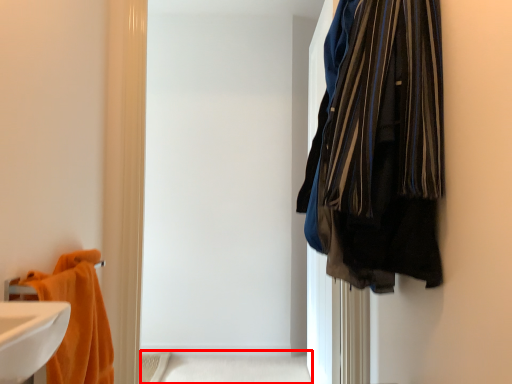
Question: From the image's perspective, considering the relative positions of bath (annotated by the red box) and towel in the image provided, where is bath (annotated by the red box) located with respect to the staircase?

Choices:
 (A) above
 (B) below

Answer: (B)